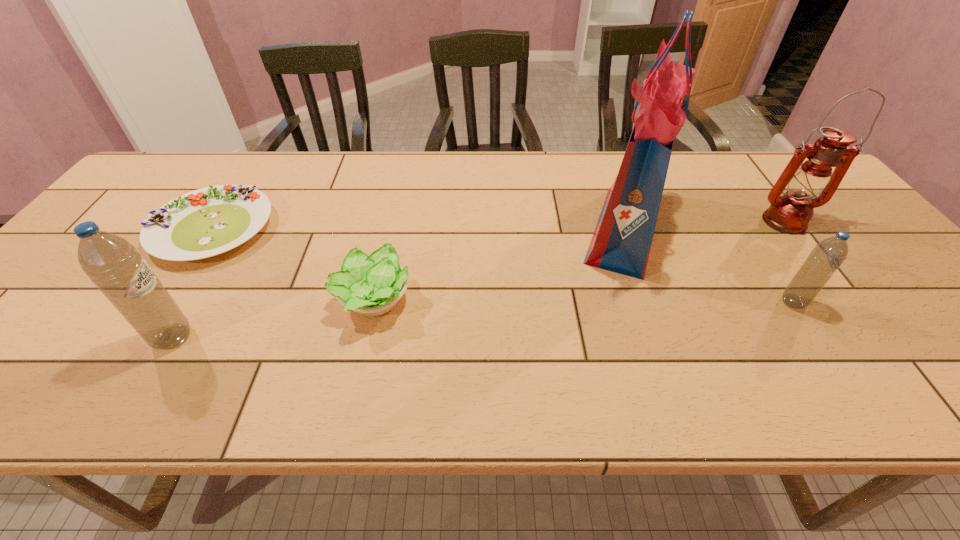
Locate an element on the screen. The image size is (960, 540). the taller water bottle is located at coordinates (113, 264).

Where is `the nearer water bottle`? The image size is (960, 540). the nearer water bottle is located at coordinates (113, 264).

Find the location of a particular element. The height and width of the screenshot is (540, 960). the right water bottle is located at coordinates (827, 256).

The image size is (960, 540). Find the location of `the fourth tallest object`. the fourth tallest object is located at coordinates (827, 256).

I want to click on grocery bag, so click(x=621, y=243).

The height and width of the screenshot is (540, 960). I want to click on the third object from right to left, so click(x=621, y=243).

I want to click on the rightmost object, so pyautogui.click(x=790, y=213).

Locate an element on the screen. oil lamp is located at coordinates (790, 213).

Find the location of a particular element. This screenshot has width=960, height=540. the shortest object is located at coordinates (206, 222).

The width and height of the screenshot is (960, 540). In order to click on the second shortest object in this screenshot , I will do `click(372, 285)`.